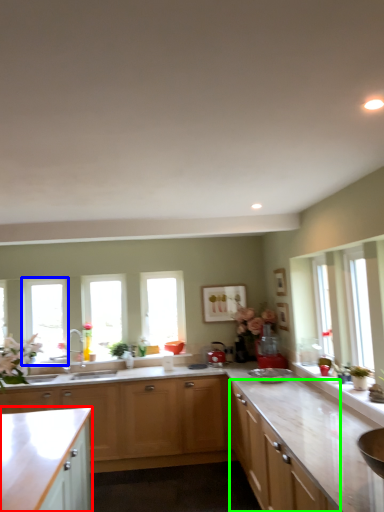
Question: Which object is positioned farthest from cabinetry (highlighted by a red box)? Select from window (highlighted by a blue box) and cabinetry (highlighted by a green box).

Choices:
 (A) window
 (B) cabinetry

Answer: (A)